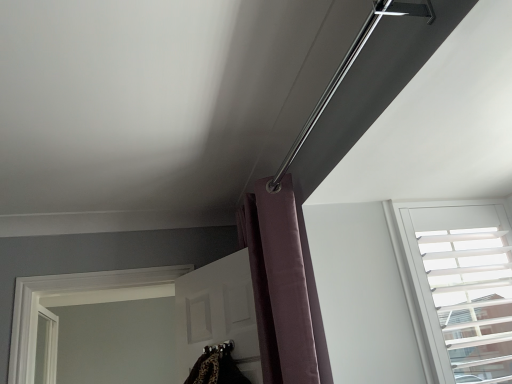
Find the location of a particular element. purple velvet curtain at upper center is located at coordinates (281, 285).

Describe the element at coordinates (281, 285) in the screenshot. I see `purple velvet curtain at upper center` at that location.

Find the location of `white textured blinds at upper right`. white textured blinds at upper right is located at coordinates (460, 286).

What do you see at coordinates (460, 286) in the screenshot? The height and width of the screenshot is (384, 512). I see `white textured blinds at upper right` at bounding box center [460, 286].

Where is `purple velvet curtain at upper center`? purple velvet curtain at upper center is located at coordinates (281, 285).

Is purple velvet curtain at upper center to the left of white textured blinds at upper right from the viewer's perspective?

Correct, you'll find purple velvet curtain at upper center to the left of white textured blinds at upper right.

Is purple velvet curtain at upper center behind white textured blinds at upper right?

No.

Is point (259, 329) farther from viewer compared to point (429, 343)?

Yes.

From the image's perspective, is purple velvet curtain at upper center on white textured blinds at upper right?

Yes, from the image's perspective, purple velvet curtain at upper center is on top of white textured blinds at upper right.

From a real-world perspective, which object rests below the other?

From a 3D spatial view, white textured blinds at upper right is below.

Which of these two, purple velvet curtain at upper center or white textured blinds at upper right, is thinner?

white textured blinds at upper right.

Can you confirm if purple velvet curtain at upper center is taller than white textured blinds at upper right?

Yes, purple velvet curtain at upper center is taller than white textured blinds at upper right.

Who is smaller, purple velvet curtain at upper center or white textured blinds at upper right?

With smaller size is white textured blinds at upper right.

Is white textured blinds at upper right a part of purple velvet curtain at upper center?

No, white textured blinds at upper right is located outside of purple velvet curtain at upper center.

Would you say purple velvet curtain at upper center is a long distance from white textured blinds at upper right?

No, purple velvet curtain at upper center is not far from white textured blinds at upper right.

Could you tell me if purple velvet curtain at upper center is facing white textured blinds at upper right?

No.

How much distance is there between purple velvet curtain at upper center and white textured blinds at upper right?

The distance of purple velvet curtain at upper center from white textured blinds at upper right is 21.12 inches.

In the image, there is a purple velvet curtain at upper center. Where is `window below it (from the image's perspective)`? The width and height of the screenshot is (512, 384). window below it (from the image's perspective) is located at coordinates (460, 286).

Is white textured blinds at upper right at the left side of purple velvet curtain at upper center?

In fact, white textured blinds at upper right is to the right of purple velvet curtain at upper center.

Which object is more forward, white textured blinds at upper right or purple velvet curtain at upper center?

purple velvet curtain at upper center is more forward.

Which is closer, (459, 327) or (285, 322)?

Point (459, 327) is positioned farther from the camera compared to point (285, 322).

From the image's perspective, who appears lower, white textured blinds at upper right or purple velvet curtain at upper center?

From the image's view, white textured blinds at upper right is below.

From a real-world perspective, which is physically below, white textured blinds at upper right or purple velvet curtain at upper center?

white textured blinds at upper right.

Which object is thinner, white textured blinds at upper right or purple velvet curtain at upper center?

Thinner between the two is white textured blinds at upper right.

Between white textured blinds at upper right and purple velvet curtain at upper center, which one has more height?

purple velvet curtain at upper center is taller.

Between white textured blinds at upper right and purple velvet curtain at upper center, which one has larger size?

Bigger between the two is purple velvet curtain at upper center.

Is white textured blinds at upper right positioned beyond the bounds of purple velvet curtain at upper center?

Yes, white textured blinds at upper right is located beyond the bounds of purple velvet curtain at upper center.

Does white textured blinds at upper right touch purple velvet curtain at upper center?

white textured blinds at upper right is not next to purple velvet curtain at upper center, and they're not touching.

Is white textured blinds at upper right facing away from purple velvet curtain at upper center?

No, white textured blinds at upper right is not facing away from purple velvet curtain at upper center.

Where is `window located behind the purple velvet curtain at upper center`? Image resolution: width=512 pixels, height=384 pixels. window located behind the purple velvet curtain at upper center is located at coordinates (460, 286).

In order to click on window behind the purple velvet curtain at upper center in this screenshot , I will do 460,286.

This screenshot has height=384, width=512. I want to click on window lying below the purple velvet curtain at upper center (from the image's perspective), so click(x=460, y=286).